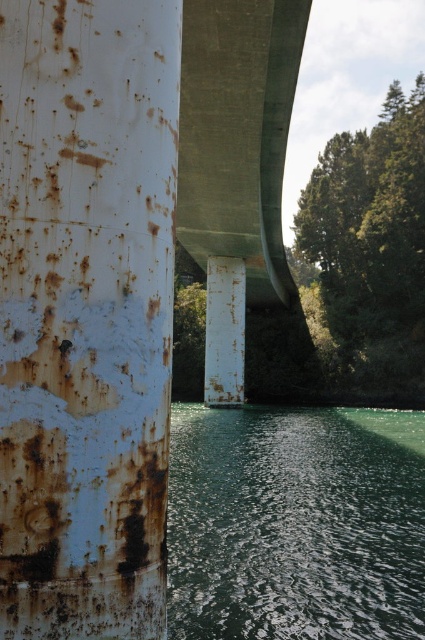
Question: In this image, where is green reflective water at lower center located relative to rusty metal pole at center?

Choices:
 (A) above
 (B) below

Answer: (B)

Question: Which object appears farthest from the camera in this image?

Choices:
 (A) green reflective water at lower center
 (B) rusty metal pole at center
 (C) rusty metal pole at left

Answer: (B)

Question: Can you confirm if rusty metal pole at left is positioned below green reflective water at lower center?

Choices:
 (A) yes
 (B) no

Answer: (B)

Question: Which point is farther from the camera taking this photo?

Choices:
 (A) (229, 556)
 (B) (243, 401)

Answer: (B)

Question: Which point is closer to the camera taking this photo?

Choices:
 (A) (68, 435)
 (B) (345, 632)
 (C) (227, 326)

Answer: (A)

Question: Does rusty metal pole at left appear over rusty metal pole at center?

Choices:
 (A) yes
 (B) no

Answer: (A)